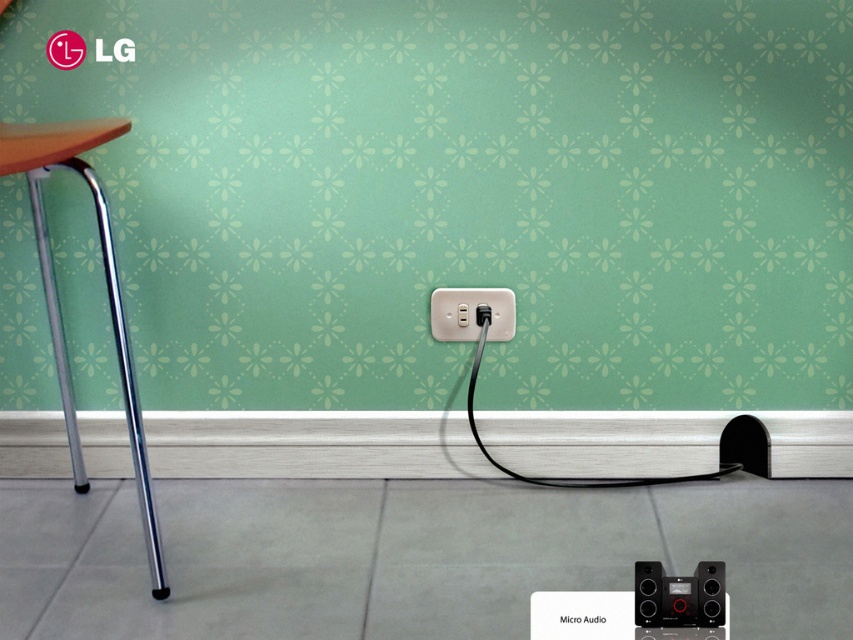
Question: Is black glossy speaker at lower right wider than black plastic speaker at lower right?

Choices:
 (A) no
 (B) yes

Answer: (B)

Question: Considering the relative positions of silver/chrome chair leg at left and black glossy speaker at lower right in the image provided, where is silver/chrome chair leg at left located with respect to black glossy speaker at lower right?

Choices:
 (A) below
 (B) above

Answer: (B)

Question: Among these points, which one is farthest from the camera?

Choices:
 (A) [x=645, y=561]
 (B) [x=720, y=467]
 (C) [x=715, y=572]

Answer: (B)

Question: Which object is farther from the camera taking this photo?

Choices:
 (A) beige plastic electrical outlet at center
 (B) black plastic speaker at lower right
 (C) black cable at lower center
 (D) black matte speaker at lower right

Answer: (A)

Question: Which object is farther from the camera taking this photo?

Choices:
 (A) black matte speaker at lower right
 (B) silver/chrome chair leg at left
 (C) black cable at lower center

Answer: (C)

Question: Is silver/chrome chair leg at left to the right of black matte speaker at lower right from the viewer's perspective?

Choices:
 (A) no
 (B) yes

Answer: (A)